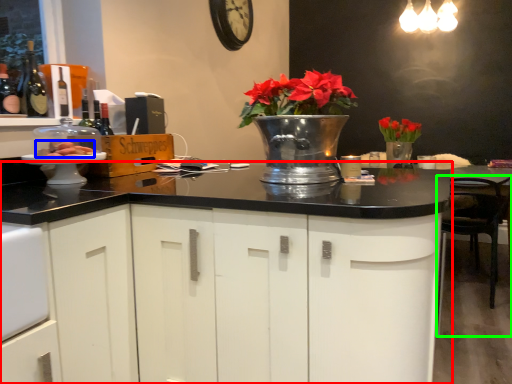
Question: Considering the real-world distances, which object is farthest from cabinetry (highlighted by a red box)? food (highlighted by a blue box) or chair (highlighted by a green box)?

Choices:
 (A) food
 (B) chair

Answer: (B)